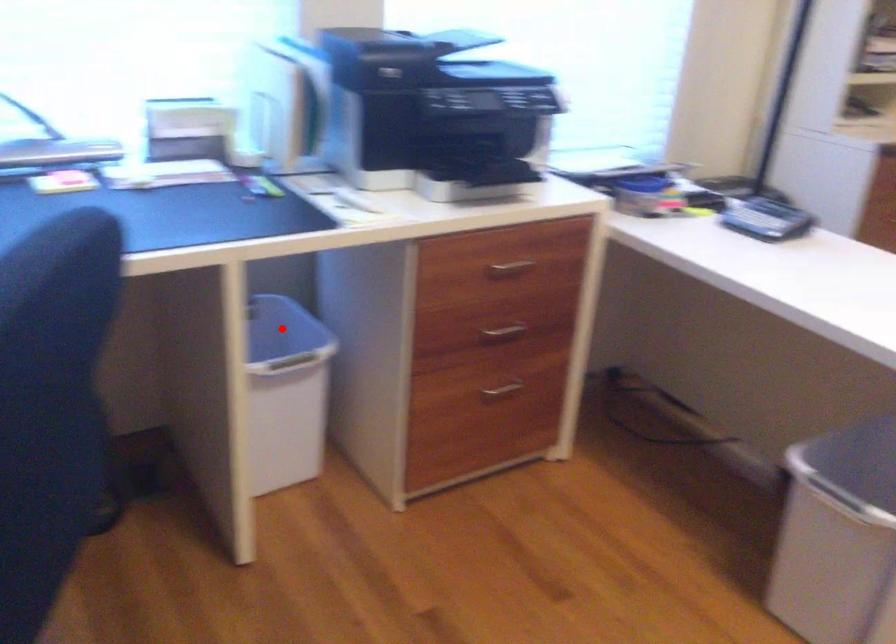
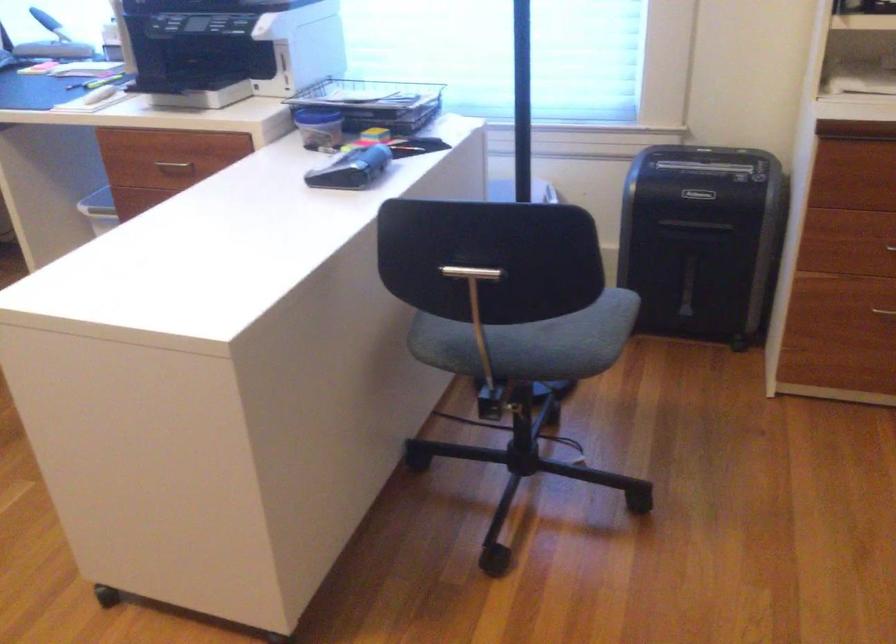
Question: I am providing you with two images of the same scene from different viewpoints. A red point is marked on the first image. Is the red point's position out of view in image 2?

Choices:
 (A) Yes
 (B) No

Answer: (A)